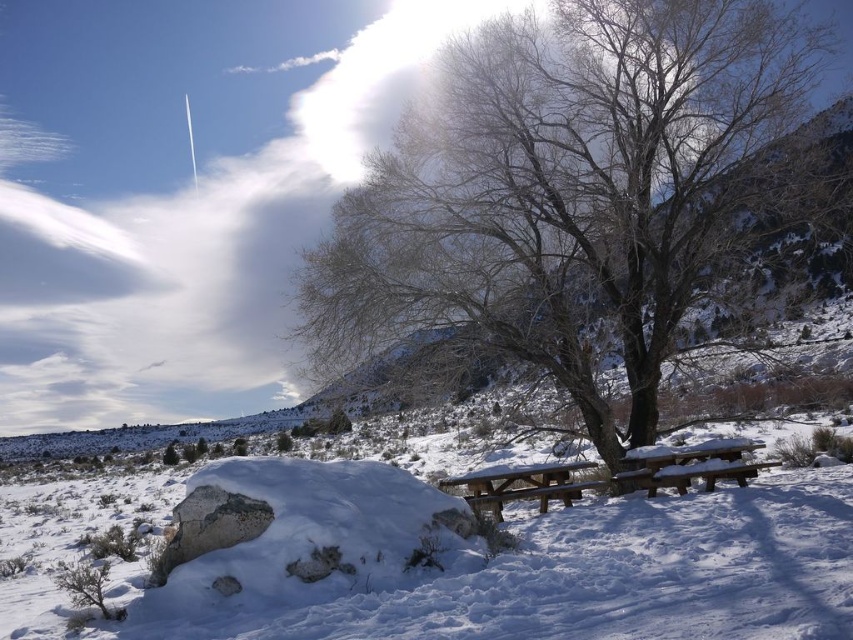
Question: From the image, what is the correct spatial relationship of snow-covered tree at center in relation to brown wooden picnic table at center?

Choices:
 (A) right
 (B) left

Answer: (A)

Question: Can you confirm if snow-covered tree at center is positioned to the left of snow-covered wooden picnic table at center?

Choices:
 (A) yes
 (B) no

Answer: (A)

Question: Does snow-covered tree at center have a larger size compared to snow-covered wooden picnic table at center?

Choices:
 (A) yes
 (B) no

Answer: (A)

Question: Which is nearer to the snow-covered wooden picnic table at center?

Choices:
 (A) brown wooden picnic table at center
 (B) snow-covered tree at center

Answer: (A)

Question: Which point is closer to the camera taking this photo?

Choices:
 (A) (706, 467)
 (B) (468, 476)

Answer: (A)

Question: Which point is farther to the camera?

Choices:
 (A) brown wooden picnic table at center
 (B) snow-covered wooden picnic table at center

Answer: (B)